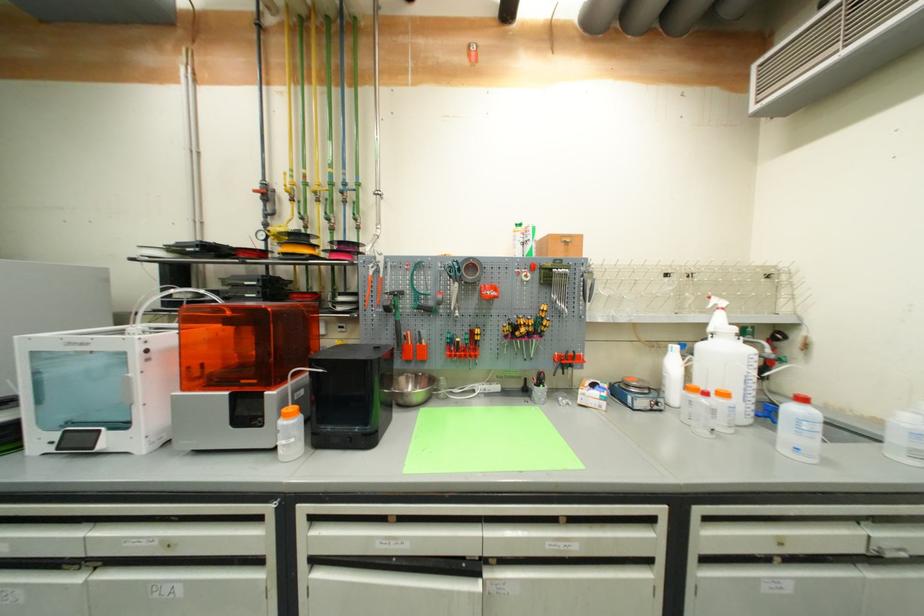
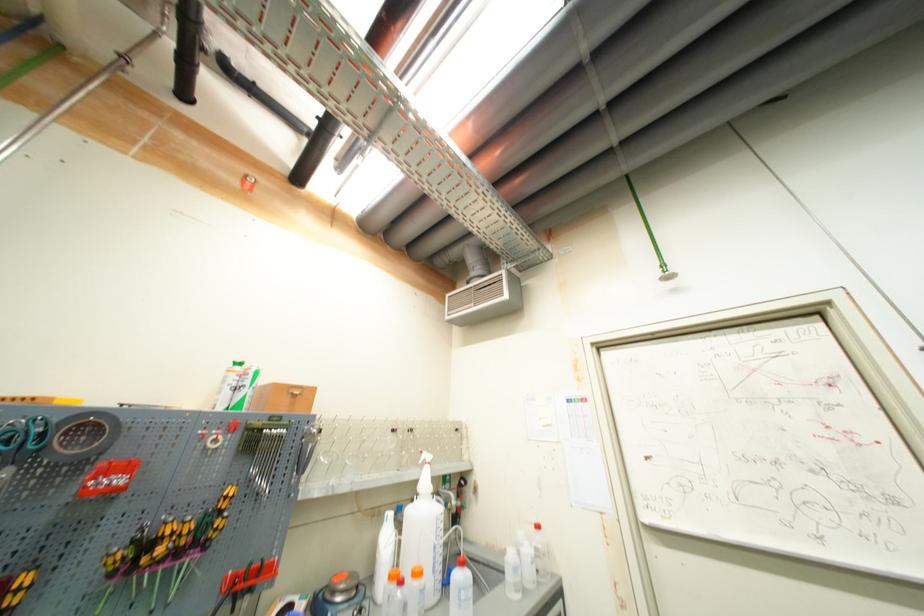
Where in the second image is the point corresponding to the point at 512,334 from the first image?

(116, 570)